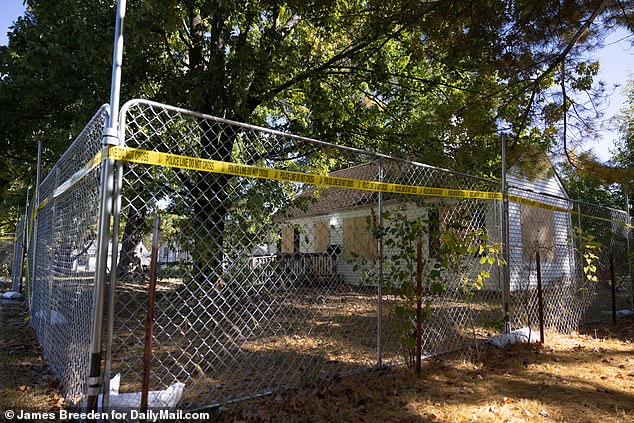
Identify the location of plant. The image size is (634, 423). (402, 266), (591, 269).